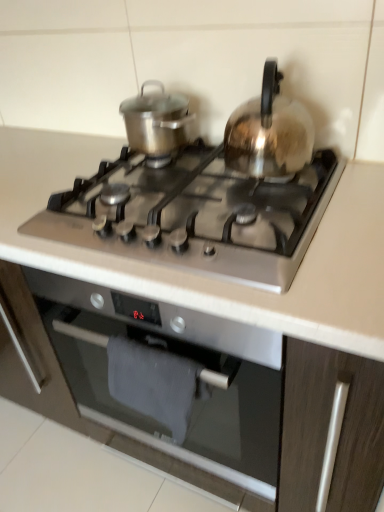
Question: Does satin silver oven at center appear on the left side of satin silver gas stove at center?

Choices:
 (A) yes
 (B) no

Answer: (B)

Question: Can you confirm if satin silver oven at center is smaller than satin silver gas stove at center?

Choices:
 (A) yes
 (B) no

Answer: (B)

Question: Is satin silver oven at center bigger than satin silver gas stove at center?

Choices:
 (A) no
 (B) yes

Answer: (B)

Question: Considering the relative sizes of satin silver oven at center and satin silver gas stove at center in the image provided, is satin silver oven at center taller than satin silver gas stove at center?

Choices:
 (A) yes
 (B) no

Answer: (A)

Question: Is satin silver oven at center closer to camera compared to satin silver gas stove at center?

Choices:
 (A) no
 (B) yes

Answer: (A)

Question: Is point (246, 101) positioned closer to the camera than point (46, 325)?

Choices:
 (A) farther
 (B) closer

Answer: (B)

Question: Would you say satin silver kettle at upper right, the first kitchen appliance viewed from the right, is inside or outside satin silver oven at center?

Choices:
 (A) inside
 (B) outside

Answer: (B)

Question: From a real-world perspective, is satin silver kettle at upper right, the first kitchen appliance viewed from the right, physically located above or below satin silver oven at center?

Choices:
 (A) below
 (B) above

Answer: (B)

Question: In terms of height, does satin silver kettle at upper right, positioned as the second kitchen appliance in left-to-right order, look taller or shorter compared to satin silver oven at center?

Choices:
 (A) tall
 (B) short

Answer: (B)

Question: Is point (289, 188) positioned closer to the camera than point (304, 153)?

Choices:
 (A) closer
 (B) farther

Answer: (B)

Question: Relative to satin silver kettle at upper right, the first kitchen appliance viewed from the right, is satin silver gas stove at center in front or behind?

Choices:
 (A) behind
 (B) front

Answer: (B)

Question: In terms of height, does satin silver gas stove at center look taller or shorter compared to satin silver kettle at upper right, the first kitchen appliance viewed from the right?

Choices:
 (A) short
 (B) tall

Answer: (A)

Question: Is satin silver gas stove at center inside the boundaries of satin silver kettle at upper right, positioned as the second kitchen appliance in left-to-right order, or outside?

Choices:
 (A) inside
 (B) outside

Answer: (B)

Question: Is satin silver oven at center bigger or smaller than shiny metallic pot at upper left, the 1th kitchen appliance viewed from the left?

Choices:
 (A) small
 (B) big

Answer: (B)

Question: Considering the positions of satin silver oven at center and shiny metallic pot at upper left, the 1th kitchen appliance viewed from the left, in the image, is satin silver oven at center wider or thinner than shiny metallic pot at upper left, the 1th kitchen appliance viewed from the left,?

Choices:
 (A) thin
 (B) wide

Answer: (B)